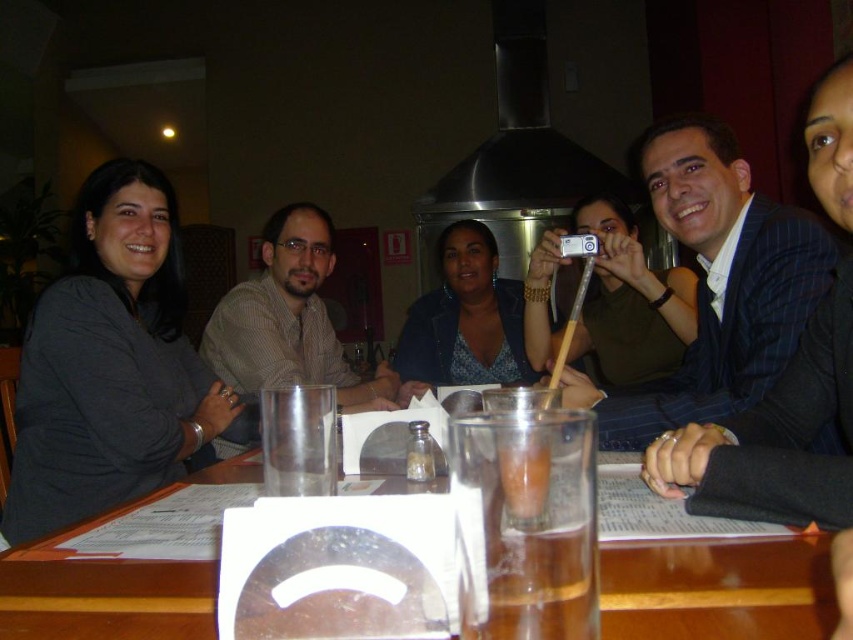
I want to click on transparent glass table at center, so click(x=718, y=589).

Is transparent glass table at center bigger than matte brown shirt at center?

Incorrect, transparent glass table at center is not larger than matte brown shirt at center.

Where is `transparent glass table at center`? The image size is (853, 640). transparent glass table at center is located at coordinates (718, 589).

Can you confirm if dark blue suit at center is positioned to the left of matte brown shirt at center?

Incorrect, dark blue suit at center is not on the left side of matte brown shirt at center.

Who is taller, dark blue suit at center or matte brown shirt at center?

With more height is matte brown shirt at center.

Who is more distant from viewer, (811,259) or (297,330)?

The point (297,330) is more distant.

Identify the location of dark blue suit at center. (718, 284).

Is dark blue suit at center in front of transparent glass table at center?

No.

Is dark blue suit at center below transparent glass table at center?

No, dark blue suit at center is not below transparent glass table at center.

What are the coordinates of `dark blue suit at center` in the screenshot? It's located at click(718, 284).

Find the location of a particular element. This screenshot has height=640, width=853. dark blue suit at center is located at coordinates (718, 284).